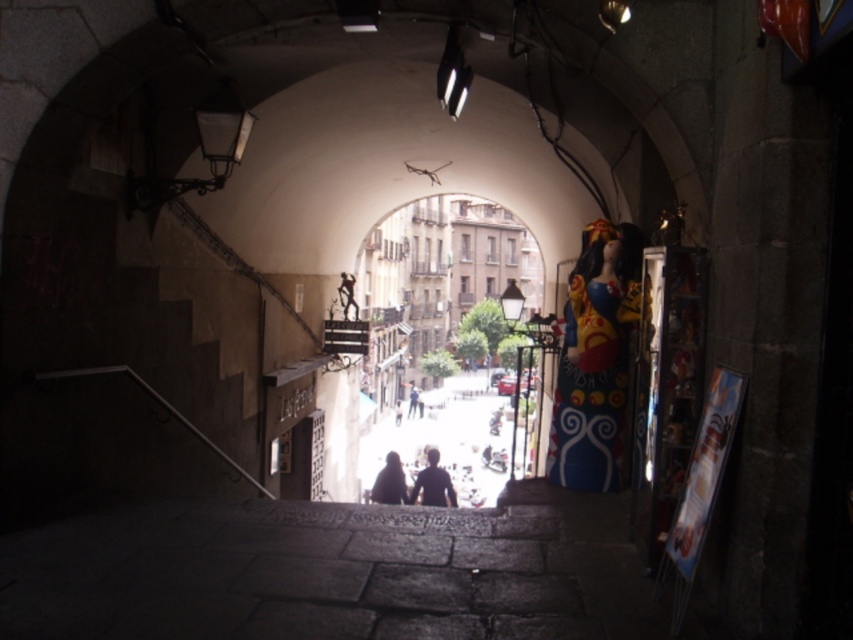
Question: Estimate the real-world distances between objects in this image. Which object is closer to the matte black figures at center?

Choices:
 (A) dark blue shirt at center
 (B) dark blue fabric at center

Answer: (A)

Question: Does dark blue shirt at center appear under dark blue fabric at center?

Choices:
 (A) no
 (B) yes

Answer: (A)

Question: Is matte black figures at center below dark blue shirt at center?

Choices:
 (A) yes
 (B) no

Answer: (A)

Question: Which object is positioned farthest from the dark matte figure at center?

Choices:
 (A) dark blue fabric at center
 (B) dark blue shirt at center
 (C) matte black figures at center

Answer: (A)

Question: Which object appears closest to the camera in this image?

Choices:
 (A) dark blue fabric at center
 (B) matte black figures at center

Answer: (B)

Question: Is matte black figures at center wider than dark blue fabric at center?

Choices:
 (A) yes
 (B) no

Answer: (A)